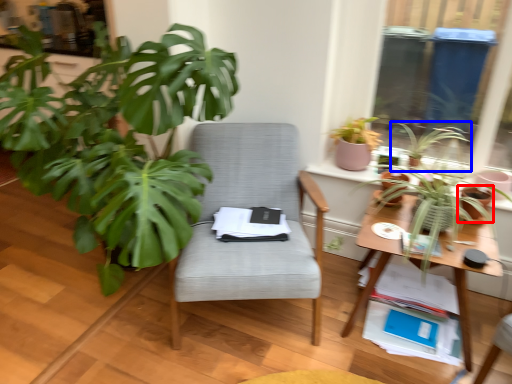
Question: Which object appears closest to the camera in this image, flowerpot (highlighted by a red box) or houseplant (highlighted by a blue box)?

Choices:
 (A) flowerpot
 (B) houseplant

Answer: (A)